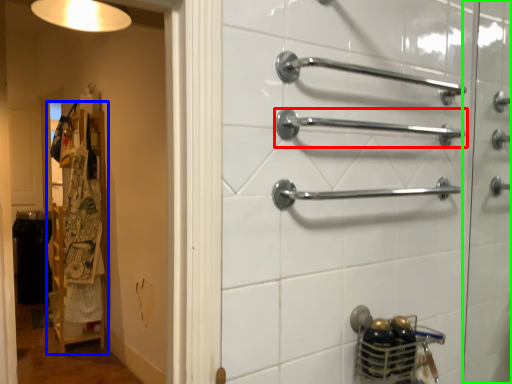
Question: Considering the real-world distances, which object is closest to towel rack (highlighted by a red box)? closet (highlighted by a blue box) or screen door (highlighted by a green box).

Choices:
 (A) closet
 (B) screen door

Answer: (B)